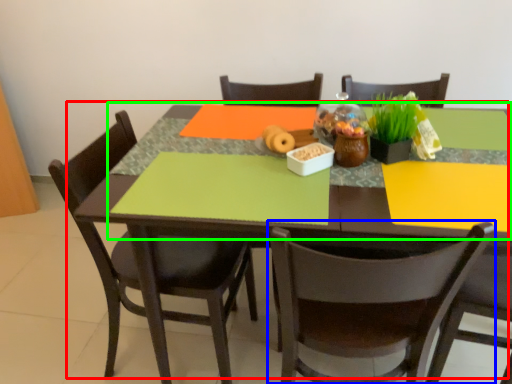
Question: Which is farther away from table (highlighted by a red box)? chair (highlighted by a blue box) or tablecloth (highlighted by a green box)?

Choices:
 (A) chair
 (B) tablecloth

Answer: (B)